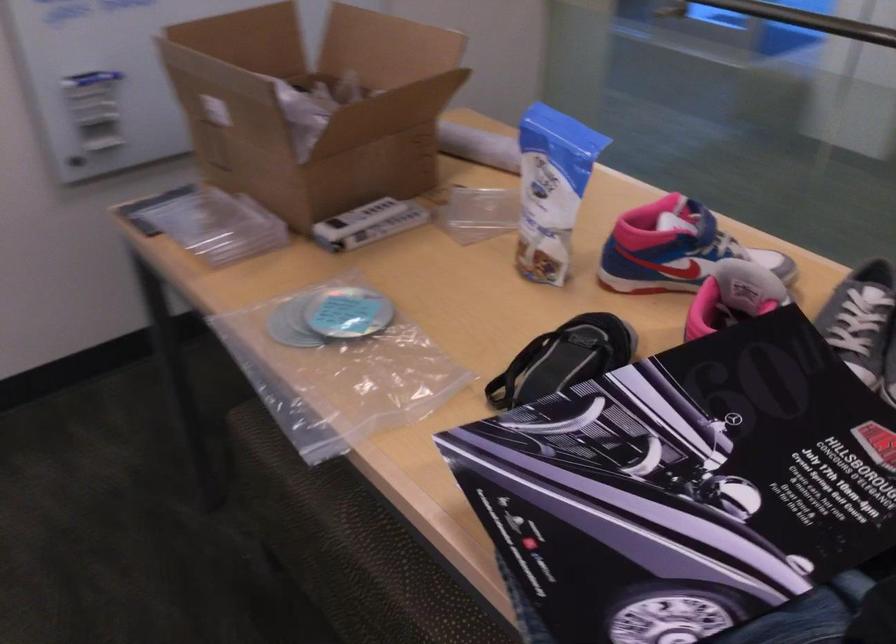
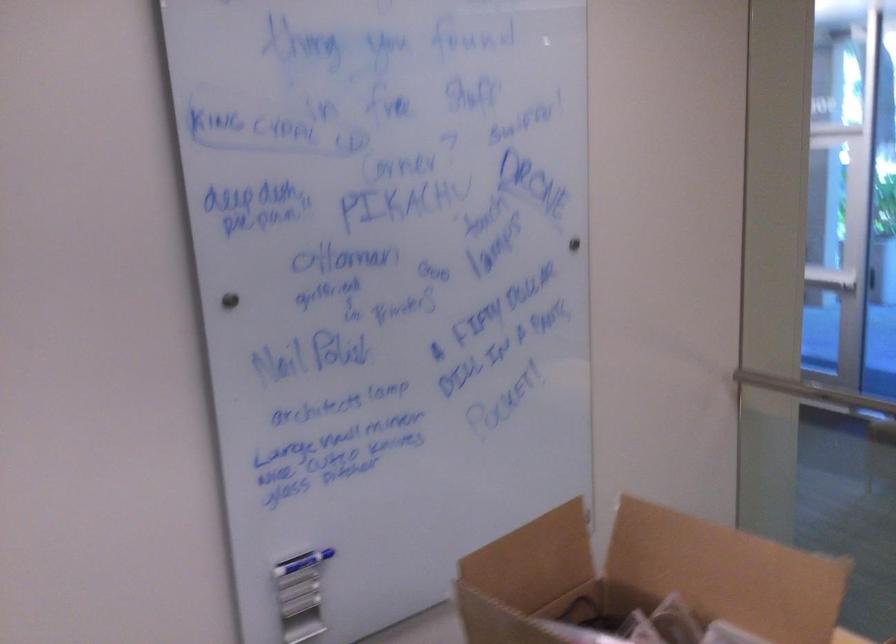
In the second image, find the point that corresponds to [79,67] in the first image.

(302, 562)